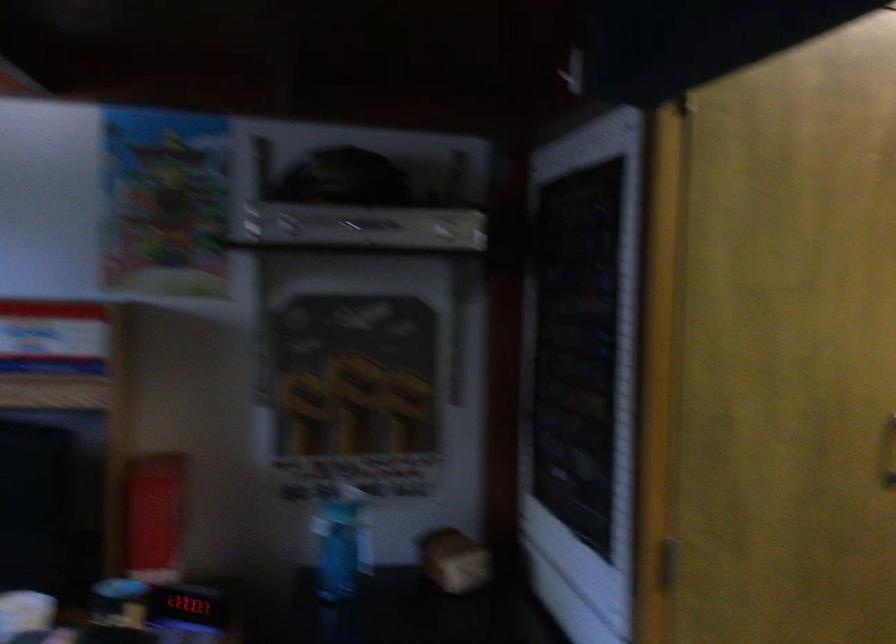
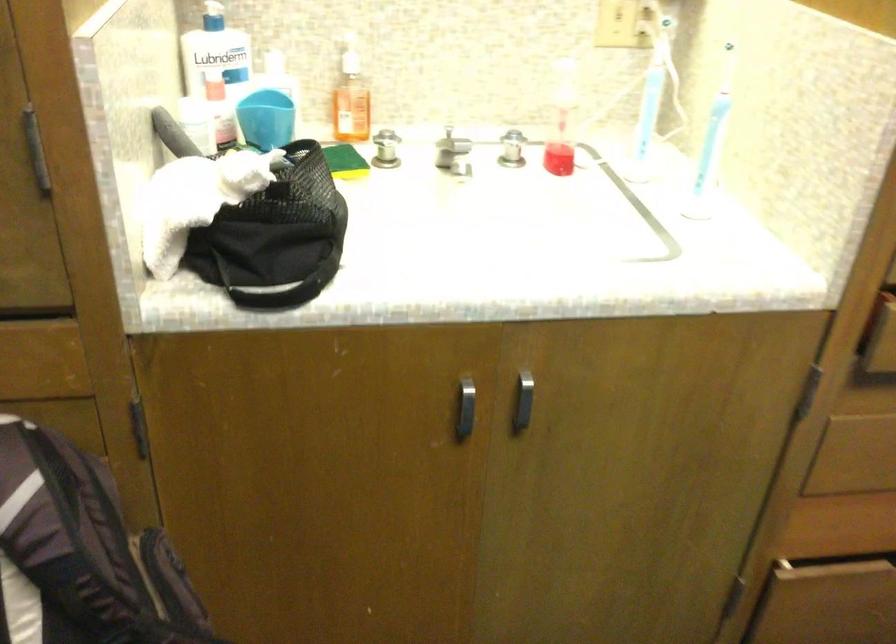
The images are taken continuously from a first-person perspective. In which direction are you moving?

The cameraman moved toward right, forward.